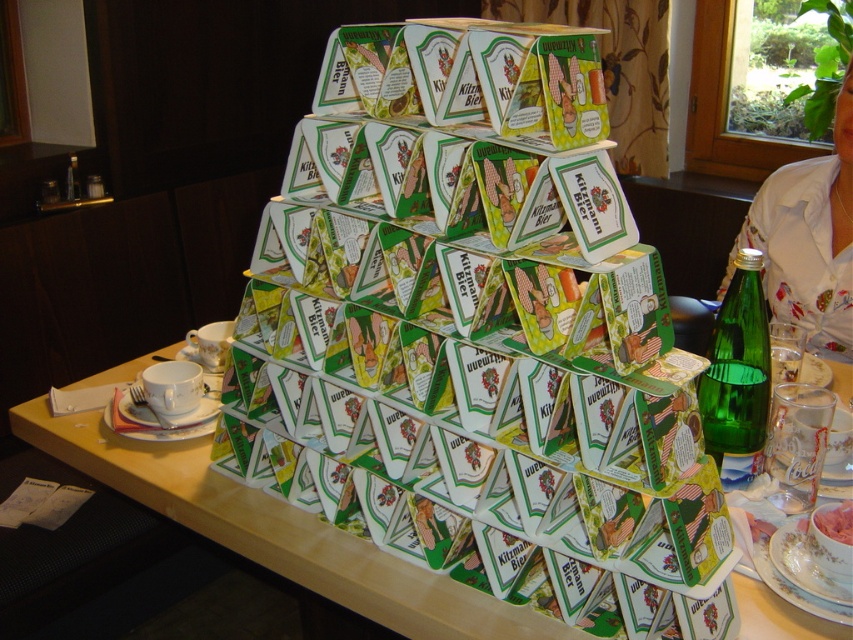
Can you confirm if white floral shirt at upper right is bigger than green glass bottle at right?

Indeed, white floral shirt at upper right has a larger size compared to green glass bottle at right.

Can you confirm if white floral shirt at upper right is positioned below green glass bottle at right?

No.

Between point (828, 294) and point (727, 349), which one is positioned in front?

Point (727, 349) is in front.

In order to click on white floral shirt at upper right in this screenshot , I will do `click(808, 240)`.

Is green cardboard house at center below green glass bottle at right?

Yes.

You are a GUI agent. You are given a task and a screenshot of the screen. Output one action in this format:
    pyautogui.click(x=<x>, y=<y>)
    Task: Click on the green cardboard house at center
    The height and width of the screenshot is (640, 853).
    Given the screenshot: What is the action you would take?
    pyautogui.click(x=473, y=372)

Is point (566, 198) farther from camera compared to point (767, 356)?

No, it is in front of (767, 356).

At what (x,y) coordinates should I click in order to perform the action: click on green cardboard house at center. Please return your answer as a coordinate pair (x, y). This screenshot has height=640, width=853. Looking at the image, I should click on (473, 372).

Is green cardboard house at center to the left of white floral shirt at upper right from the viewer's perspective?

Indeed, green cardboard house at center is positioned on the left side of white floral shirt at upper right.

Between point (511, 401) and point (816, 256), which one is positioned behind?

Point (816, 256)

Locate an element on the screen. Image resolution: width=853 pixels, height=640 pixels. green cardboard house at center is located at coordinates (473, 372).